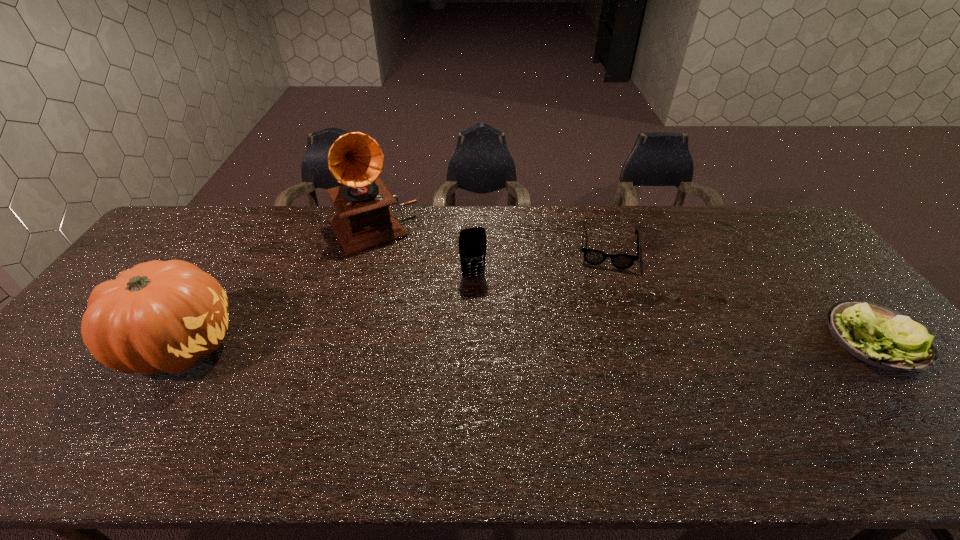
At what (x,y) coordinates should I click in order to perform the action: click on free space located on the horn of the tallest object. Please return your answer as a coordinate pair (x, y). Looking at the image, I should click on (409, 289).

Where is `spectacles that is at the far edge`? This screenshot has width=960, height=540. spectacles that is at the far edge is located at coordinates pos(594,257).

Where is `phonograph record situated at the far edge`? phonograph record situated at the far edge is located at coordinates (364, 221).

The image size is (960, 540). I want to click on object that is at the near edge, so click(x=157, y=316).

Identify the location of object at the left edge. (157, 316).

Where is `object that is at the right edge`? object that is at the right edge is located at coordinates (877, 335).

The image size is (960, 540). I want to click on object present at the near left corner, so click(x=157, y=316).

You are a GUI agent. You are given a task and a screenshot of the screen. Output one action in this format:
    pyautogui.click(x=<x>, y=<y>)
    Task: Click on the vacant space at the far edge of the desktop
    This screenshot has width=960, height=540.
    Given the screenshot: What is the action you would take?
    pyautogui.click(x=561, y=241)

Find the location of a particular element. The height and width of the screenshot is (540, 960). vacant space at the near edge of the desktop is located at coordinates (709, 389).

Find the location of a particular element. The height and width of the screenshot is (540, 960). vacant space at the right edge of the desktop is located at coordinates (920, 383).